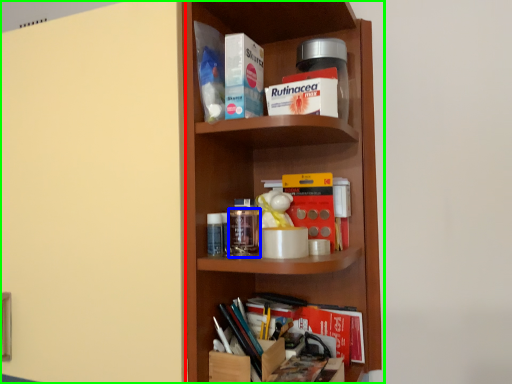
Question: Based on their relative distances, which object is nearer to door (highlighted by a red box)? Choose from glass jar (highlighted by a blue box) and shelf (highlighted by a green box).

Choices:
 (A) glass jar
 (B) shelf

Answer: (B)